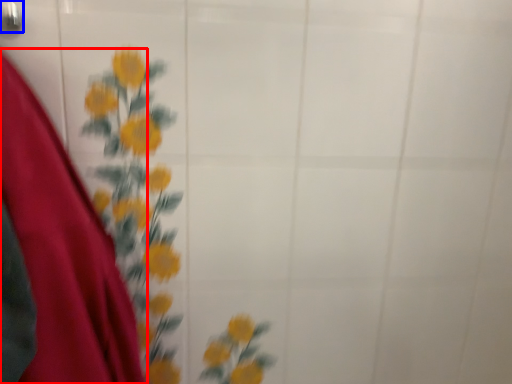
Question: Which object appears farthest to the camera in this image, dress (highlighted by a red box) or door handle (highlighted by a blue box)?

Choices:
 (A) dress
 (B) door handle

Answer: (B)